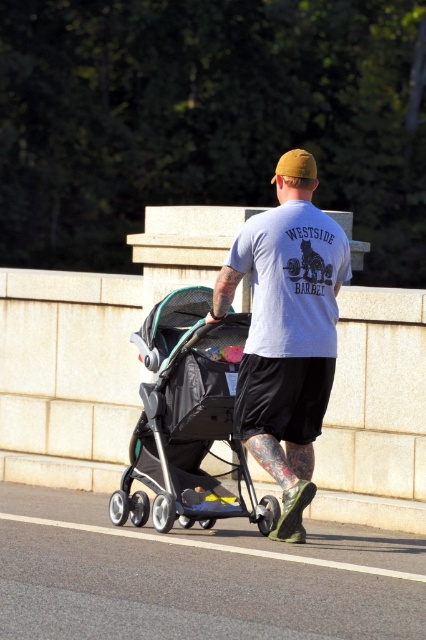
Question: Can you confirm if gray cotton t-shirt at center is positioned to the right of matte yellow baseball cap at upper center?

Choices:
 (A) no
 (B) yes

Answer: (A)

Question: Which of the following is the farthest from the observer?

Choices:
 (A) (294, 160)
 (B) (226, 371)

Answer: (B)

Question: Where is gray cotton t-shirt at center located in relation to matte yellow baseball cap at upper center in the image?

Choices:
 (A) above
 (B) below

Answer: (B)

Question: Based on their relative distances, which object is farther from the matte yellow baseball cap at upper center?

Choices:
 (A) black textured stroller at center
 (B) gray cotton t-shirt at center

Answer: (A)

Question: From the image, what is the correct spatial relationship of black textured stroller at center in relation to matte yellow baseball cap at upper center?

Choices:
 (A) left
 (B) right

Answer: (A)

Question: Which point appears closest to the camera in this image?

Choices:
 (A) (316, 170)
 (B) (218, 493)
 (C) (299, 321)

Answer: (C)